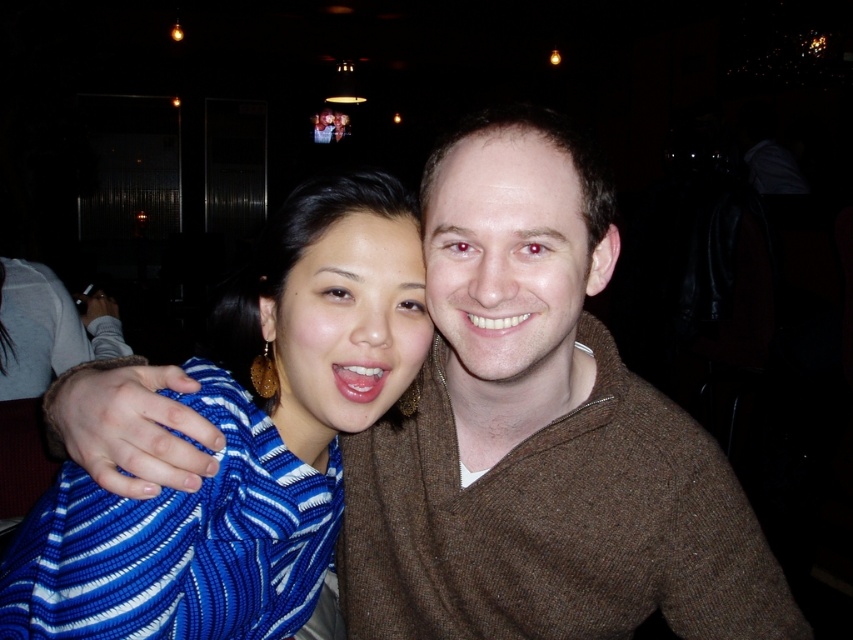
Which of these two, brown wool sweater at center or blue knitted sweater at center, stands shorter?

blue knitted sweater at center is shorter.

Can you confirm if brown wool sweater at center is bigger than blue knitted sweater at center?

Yes, brown wool sweater at center is bigger than blue knitted sweater at center.

What do you see at coordinates (540, 433) in the screenshot? The height and width of the screenshot is (640, 853). I see `brown wool sweater at center` at bounding box center [540, 433].

This screenshot has height=640, width=853. Find the location of `brown wool sweater at center`. brown wool sweater at center is located at coordinates (540, 433).